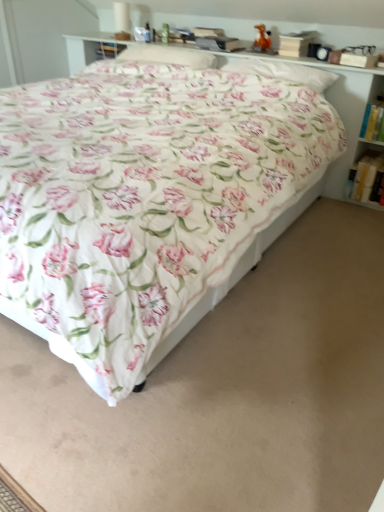
Identify the location of floral cotton bed at center. (144, 197).

What do you see at coordinates (283, 72) in the screenshot? I see `floral fabric pillow at upper center, the first pillow in the right-to-left sequence` at bounding box center [283, 72].

What is the approximate width of floral fabric pillow at upper center, arranged as the second pillow when viewed from the left?

floral fabric pillow at upper center, arranged as the second pillow when viewed from the left, is 11.15 inches in width.

Identify the location of white paper book at right, placed as the second book when sorted from top to bottom. (366, 175).

At what (x,y) coordinates should I click in order to perform the action: click on floral cotton bed at center. Please return your answer as a coordinate pair (x, y). Image resolution: width=384 pixels, height=512 pixels. Looking at the image, I should click on (144, 197).

How different are the orientations of white soft pillow at upper center, the 2th pillow positioned from the right, and white paper book at right, which is the 1th book in bottom-to-top order, in degrees?

white soft pillow at upper center, the 2th pillow positioned from the right, and white paper book at right, which is the 1th book in bottom-to-top order, are facing 0.19 degrees away from each other.

From the picture: From the image's perspective, is white soft pillow at upper center, the 2th pillow positioned from the right, located above white paper book at right, which is the 1th book in bottom-to-top order?

Correct, white soft pillow at upper center, the 2th pillow positioned from the right, appears higher than white paper book at right, which is the 1th book in bottom-to-top order, in the image.

Is point (150, 61) more distant than point (363, 184)?

That is False.

From a real-world perspective, is white soft pillow at upper center, the 2th pillow positioned from the right, physically above white paper book at right, which is the 1th book in bottom-to-top order?

Indeed, from a real-world perspective, white soft pillow at upper center, the 2th pillow positioned from the right, stands above white paper book at right, which is the 1th book in bottom-to-top order.

Is white paper book at right, placed as the second book when sorted from top to bottom, spatially inside white soft pillow at upper center, the 2th pillow positioned from the right, or outside of it?

white paper book at right, placed as the second book when sorted from top to bottom, is located beyond the bounds of white soft pillow at upper center, the 2th pillow positioned from the right.

Can you confirm if white paper book at right, which is the 1th book in bottom-to-top order, is bigger than white soft pillow at upper center, the 2th pillow positioned from the right?

Incorrect, white paper book at right, which is the 1th book in bottom-to-top order, is not larger than white soft pillow at upper center, the 2th pillow positioned from the right.

What's the angular difference between white paper book at right, which is the 1th book in bottom-to-top order, and white soft pillow at upper center, the first pillow in the left-to-right sequence,'s facing directions?

The angular difference between white paper book at right, which is the 1th book in bottom-to-top order, and white soft pillow at upper center, the first pillow in the left-to-right sequence, is 0.19 degrees.

Which is nearer, [356,197] or [170,50]?

Point [356,197] is positioned closer to the camera compared to point [170,50].

From the image's perspective, between white soft pillow at upper center, the first pillow in the left-to-right sequence, and floral cotton bed at center, who is located below?

floral cotton bed at center.

Is the position of white soft pillow at upper center, the first pillow in the left-to-right sequence, more distant than that of floral cotton bed at center?

Yes, it is.

In terms of size, does white soft pillow at upper center, the 2th pillow positioned from the right, appear bigger or smaller than floral cotton bed at center?

Considering their sizes, white soft pillow at upper center, the 2th pillow positioned from the right, takes up less space than floral cotton bed at center.

Is point (238, 69) in front of point (206, 265)?

That is False.

In the scene shown: Considering the sizes of objects floral fabric pillow at upper center, the first pillow in the right-to-left sequence, and floral cotton bed at center in the image provided, who is thinner, floral fabric pillow at upper center, the first pillow in the right-to-left sequence, or floral cotton bed at center?

floral fabric pillow at upper center, the first pillow in the right-to-left sequence.

Is floral fabric pillow at upper center, arranged as the second pillow when viewed from the left, in front of floral cotton bed at center?

No.

From the image's perspective, is white paper book at right, the 1th book positioned from the top, below white paper book at right, placed as the second book when sorted from top to bottom?

No.

Is white paper book at right, the 1th book positioned from the top, in front of or behind white paper book at right, which is the 1th book in bottom-to-top order, in the image?

Visually, white paper book at right, the 1th book positioned from the top, is located in front of white paper book at right, which is the 1th book in bottom-to-top order.

Does point (366, 130) come in front of point (365, 166)?

Yes, it is.

Based on the photo, from a real-world perspective, is white paper book at right, the 1th book positioned from the top, physically located above or below white paper book at right, placed as the second book when sorted from top to bottom?

white paper book at right, the 1th book positioned from the top, is above white paper book at right, placed as the second book when sorted from top to bottom.

From a real-world perspective, relative to floral cotton bed at center, is white paper book at right, the 1th book positioned from the top, vertically above or below?

In terms of real-world spatial position, white paper book at right, the 1th book positioned from the top, is above floral cotton bed at center.

Considering the sizes of objects white paper book at right, acting as the 2th book starting from the bottom, and floral cotton bed at center in the image provided, who is thinner, white paper book at right, acting as the 2th book starting from the bottom, or floral cotton bed at center?

white paper book at right, acting as the 2th book starting from the bottom.

In the image, is white paper book at right, the 1th book positioned from the top, positioned in front of or behind floral cotton bed at center?

white paper book at right, the 1th book positioned from the top, is behind floral cotton bed at center.

Identify the location of bed in front of the white paper book at right, acting as the 2th book starting from the bottom. This screenshot has width=384, height=512. (144, 197).

Do you think floral cotton bed at center is within white paper book at right, which is the 1th book in bottom-to-top order, or outside of it?

floral cotton bed at center is not enclosed by white paper book at right, which is the 1th book in bottom-to-top order.

Which is more to the right, floral cotton bed at center or white paper book at right, placed as the second book when sorted from top to bottom?

white paper book at right, placed as the second book when sorted from top to bottom, is more to the right.

From a real-world perspective, does floral cotton bed at center stand above white paper book at right, which is the 1th book in bottom-to-top order?

Yes, from a real-world perspective, floral cotton bed at center is above white paper book at right, which is the 1th book in bottom-to-top order.

What's the angular difference between floral cotton bed at center and white paper book at right, placed as the second book when sorted from top to bottom,'s facing directions?

There is a 0.19-degree angle between the facing directions of floral cotton bed at center and white paper book at right, placed as the second book when sorted from top to bottom.

Identify the location of pillow that appears behind the white paper book at right, placed as the second book when sorted from top to bottom. This screenshot has height=512, width=384. (169, 55).

Locate an element on the screen. The image size is (384, 512). pillow that is the 2nd one when counting leftward from the white paper book at right, which is the 1th book in bottom-to-top order is located at coordinates (169, 55).

When comparing their distances from floral cotton bed at center, does white soft pillow at upper center, the 2th pillow positioned from the right, or floral fabric pillow at upper center, arranged as the second pillow when viewed from the left, seem further?

white soft pillow at upper center, the 2th pillow positioned from the right, is positioned further to the anchor floral cotton bed at center.

Considering their positions, is floral fabric pillow at upper center, the first pillow in the right-to-left sequence, positioned further to floral cotton bed at center than white soft pillow at upper center, the 2th pillow positioned from the right?

white soft pillow at upper center, the 2th pillow positioned from the right, is positioned further to the anchor floral cotton bed at center.

Which object lies further to the anchor point floral cotton bed at center, white paper book at right, the 1th book positioned from the top, or white soft pillow at upper center, the 2th pillow positioned from the right?

white paper book at right, the 1th book positioned from the top, lies further to floral cotton bed at center than the other object.

Which object lies nearer to the anchor point white soft pillow at upper center, the first pillow in the left-to-right sequence, white paper book at right, which is the 1th book in bottom-to-top order, or floral cotton bed at center?

floral cotton bed at center is positioned closer to the anchor white soft pillow at upper center, the first pillow in the left-to-right sequence.

Based on their spatial positions, is floral cotton bed at center or white soft pillow at upper center, the first pillow in the left-to-right sequence, closer to white paper book at right, acting as the 2th book starting from the bottom?

Among the two, white soft pillow at upper center, the first pillow in the left-to-right sequence, is located nearer to white paper book at right, acting as the 2th book starting from the bottom.

In the scene shown: Based on their spatial positions, is floral fabric pillow at upper center, arranged as the second pillow when viewed from the left, or floral cotton bed at center further from white paper book at right, acting as the 2th book starting from the bottom?

floral cotton bed at center lies further to white paper book at right, acting as the 2th book starting from the bottom, than the other object.

Which object lies nearer to the anchor point white paper book at right, the 1th book positioned from the top, floral fabric pillow at upper center, the first pillow in the right-to-left sequence, or white soft pillow at upper center, the first pillow in the left-to-right sequence?

floral fabric pillow at upper center, the first pillow in the right-to-left sequence.

When comparing their distances from white paper book at right, placed as the second book when sorted from top to bottom, does white paper book at right, acting as the 2th book starting from the bottom, or floral cotton bed at center seem closer?

Based on the image, white paper book at right, acting as the 2th book starting from the bottom, appears to be nearer to white paper book at right, placed as the second book when sorted from top to bottom.

Image resolution: width=384 pixels, height=512 pixels. Find the location of `book between white soft pillow at upper center, the first pillow in the left-to-right sequence, and white paper book at right, the 1th book positioned from the top, from left to right`. book between white soft pillow at upper center, the first pillow in the left-to-right sequence, and white paper book at right, the 1th book positioned from the top, from left to right is located at coordinates (366, 175).

The image size is (384, 512). In order to click on book located between floral cotton bed at center and white paper book at right, which is the 1th book in bottom-to-top order, in the depth direction in this screenshot , I will do `click(372, 121)`.

Find the location of a particular element. This screenshot has width=384, height=512. pillow between floral cotton bed at center and white soft pillow at upper center, the first pillow in the left-to-right sequence, in the front-back direction is located at coordinates (283, 72).

In order to click on pillow located between white soft pillow at upper center, the 2th pillow positioned from the right, and white paper book at right, placed as the second book when sorted from top to bottom, in the left-right direction in this screenshot , I will do `click(283, 72)`.